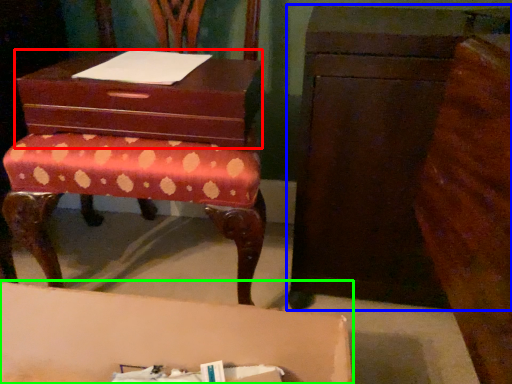
Question: Which object is positioned farthest from storage box (highlighted by a red box)? Select from chest of drawers (highlighted by a blue box) and table (highlighted by a green box).

Choices:
 (A) chest of drawers
 (B) table

Answer: (B)